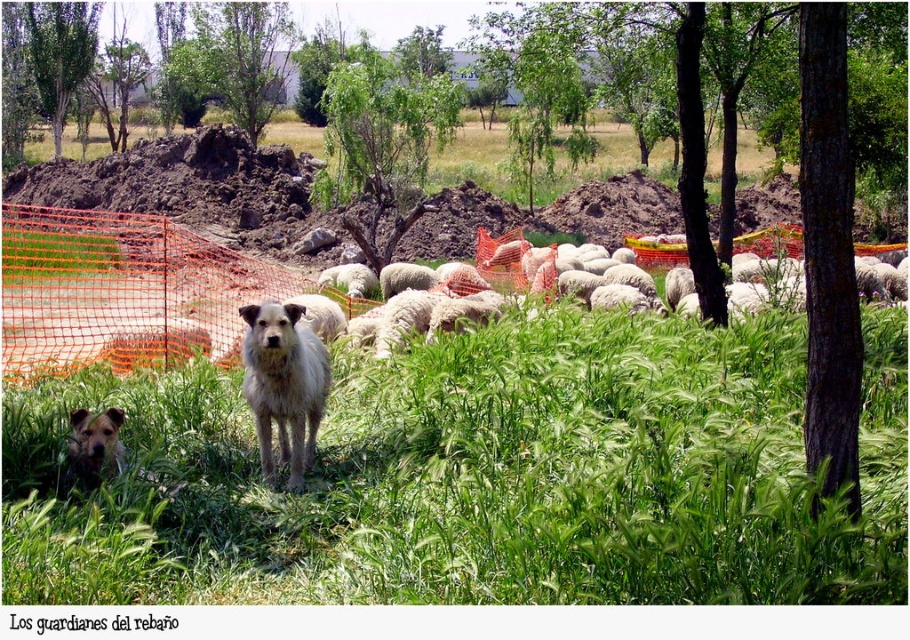
Can you confirm if green leafy tree at center is positioned below white woolly sheep at center?

No, green leafy tree at center is not below white woolly sheep at center.

Does point (451, 109) lie behind point (552, 276)?

Yes, point (451, 109) is farther from viewer.

The width and height of the screenshot is (910, 640). I want to click on green leafy tree at center, so click(383, 144).

How much distance is there between green grassy at center and white shaggy dog at center?

The distance of green grassy at center from white shaggy dog at center is 29.61 inches.

Who is more distant from viewer, (721,515) or (279,433)?

The point (279,433) is more distant.

Find the location of a particular element. The height and width of the screenshot is (640, 910). green grassy at center is located at coordinates (484, 476).

In the scene shown: Which is more to the right, white shaggy dog at center or green leafy tree at upper left?

white shaggy dog at center

Does white shaggy dog at center have a larger size compared to green leafy tree at upper left?

Yes, white shaggy dog at center is bigger than green leafy tree at upper left.

Is point (261, 346) positioned behind point (41, 93)?

No, it is in front of (41, 93).

At what (x,y) coordinates should I click in order to perform the action: click on white shaggy dog at center. Please return your answer as a coordinate pair (x, y). The height and width of the screenshot is (640, 910). Looking at the image, I should click on (284, 385).